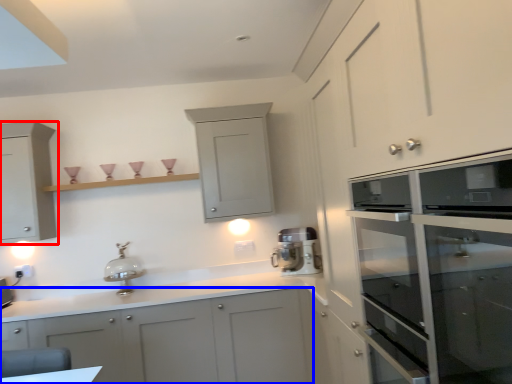
Question: Which object appears farthest to the camera in this image, cabinetry (highlighted by a red box) or cabinetry (highlighted by a blue box)?

Choices:
 (A) cabinetry
 (B) cabinetry

Answer: (A)